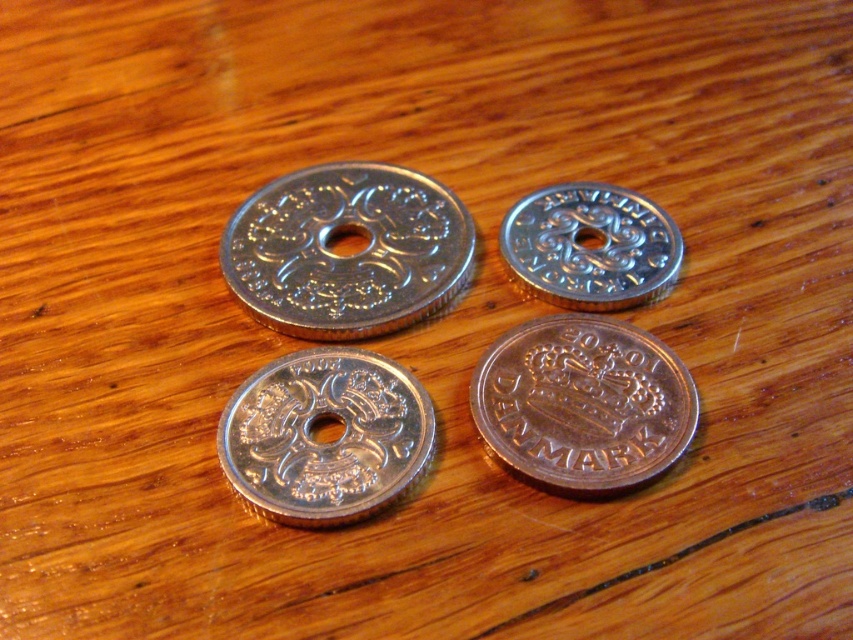
Consider the image. Who is positioned more to the right, shiny silver coin at center or shiny silver coin at bottom right?

shiny silver coin at bottom right

Is shiny silver coin at center positioned behind shiny silver coin at bottom right?

Yes.

Image resolution: width=853 pixels, height=640 pixels. Find the location of `shiny silver coin at center`. shiny silver coin at center is located at coordinates (347, 253).

Can you confirm if shiny silver coin at bottom right is wider than silver/metallic coin at upper right?

Indeed, shiny silver coin at bottom right has a greater width compared to silver/metallic coin at upper right.

Is shiny silver coin at bottom right taller than silver/metallic coin at upper right?

Yes.

Between point (512, 381) and point (527, 276), which one is positioned in front?

Point (512, 381) is in front.

Locate an element on the screen. shiny silver coin at bottom right is located at coordinates (583, 403).

Between shiny silver coin at center and silver metallic coin at center, which one is positioned lower?

Positioned lower is silver metallic coin at center.

Which is behind, point (276, 202) or point (270, 458)?

The point (276, 202) is behind.

Locate an element on the screen. shiny silver coin at center is located at coordinates (347, 253).